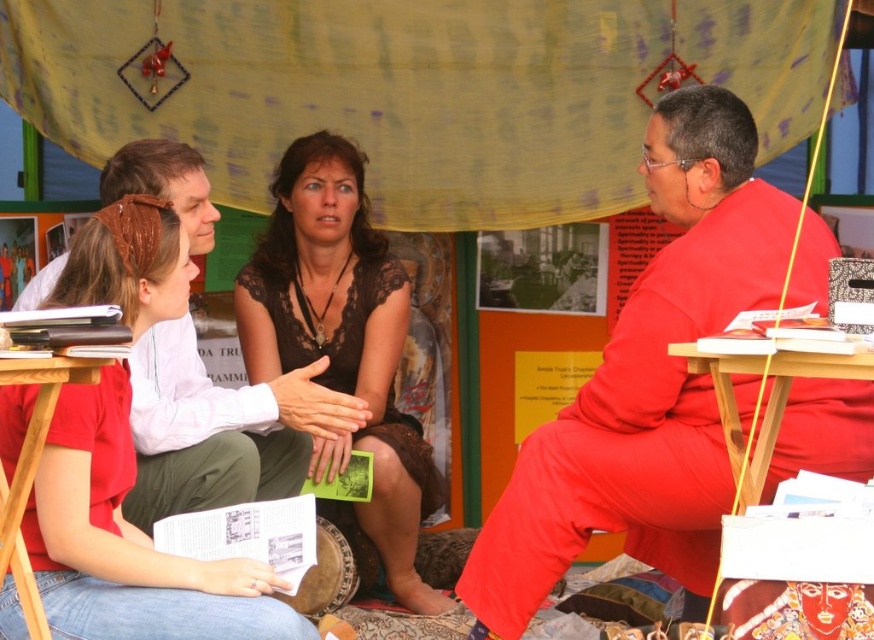
You are organizing a costume party and need to decide which costume to wear. You have two options from the image provided. The first is the matte red robe at center, and the second is the matte white shirt at center. Given that you want a costume that is larger in size, which one should you choose?

The matte red robe at center is bigger than the matte white shirt at center, so you should choose the matte red robe at center for a larger costume.

You are a photographer planning to capture a group photo of the matte red robe at center and the black lace dress at center. Considering their heights, which one should you position closer to the camera to ensure both are fully visible in the frame?

The matte red robe at center is not as tall as the black lace dress at center. To ensure both are fully visible in the frame, position the matte red robe at center closer to the camera so that its shorter height doesn